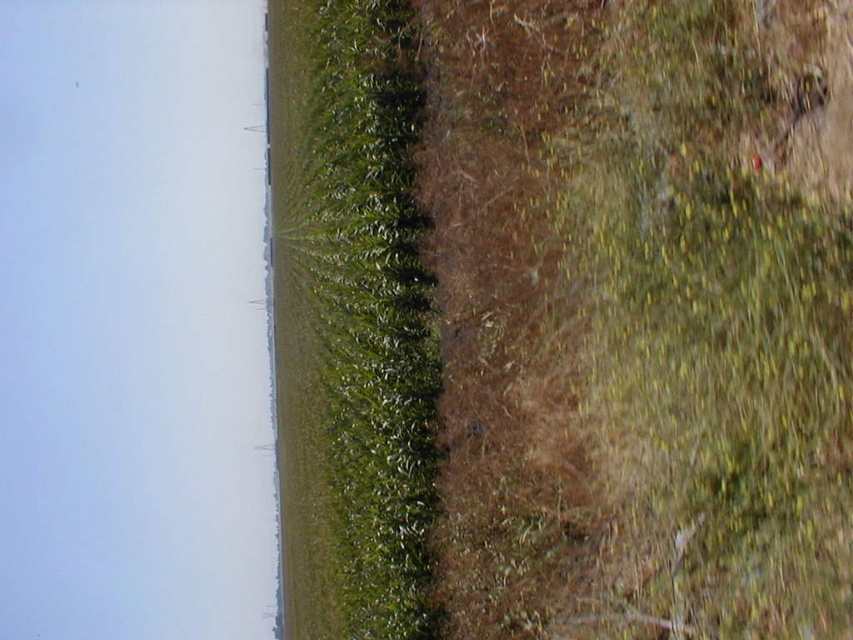
In the scene shown: Does green grass at center have a greater height compared to green leafy grass at center?

No.

The image size is (853, 640). In order to click on green grass at center in this screenshot , I will do `click(564, 317)`.